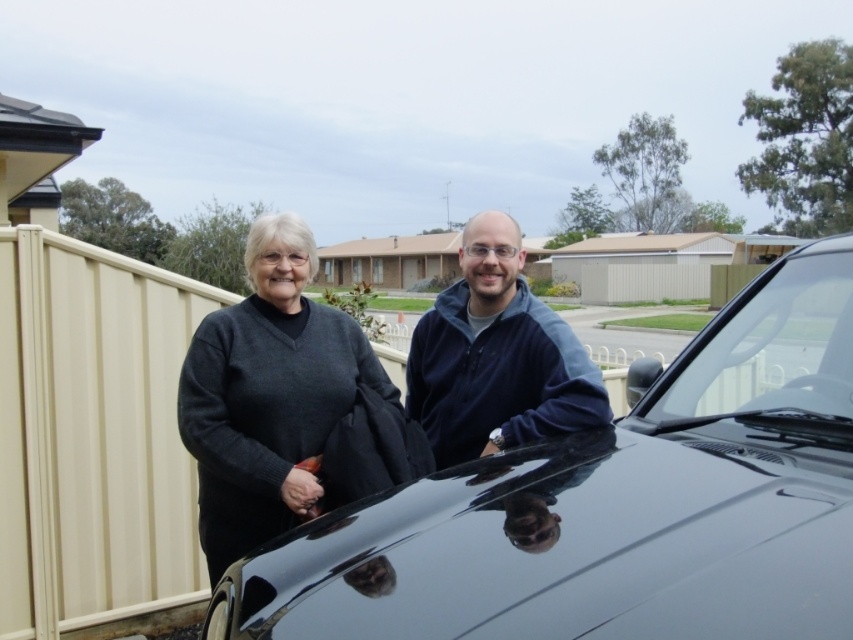
Does dark gray sweater at left appear over blue fleece jacket at center?

Actually, dark gray sweater at left is below blue fleece jacket at center.

Who is more distant from viewer, (305, 476) or (410, 385)?

Point (410, 385)

The height and width of the screenshot is (640, 853). Identify the location of dark gray sweater at left. 268,394.

Does glossy black car at center have a lesser height compared to dark gray sweater at left?

Indeed, glossy black car at center has a lesser height compared to dark gray sweater at left.

This screenshot has height=640, width=853. What are the coordinates of `glossy black car at center` in the screenshot? It's located at (614, 506).

Describe the element at coordinates (614, 506) in the screenshot. The width and height of the screenshot is (853, 640). I see `glossy black car at center` at that location.

The width and height of the screenshot is (853, 640). I want to click on glossy black car at center, so click(x=614, y=506).

Which of these two, dark gray sweater at left or clear glass windshield at upper center, stands shorter?

With less height is clear glass windshield at upper center.

Can you confirm if dark gray sweater at left is bigger than clear glass windshield at upper center?

Indeed, dark gray sweater at left has a larger size compared to clear glass windshield at upper center.

Between point (238, 416) and point (737, 317), which one is positioned behind?

Point (737, 317)

The width and height of the screenshot is (853, 640). What are the coordinates of `dark gray sweater at left` in the screenshot? It's located at (268, 394).